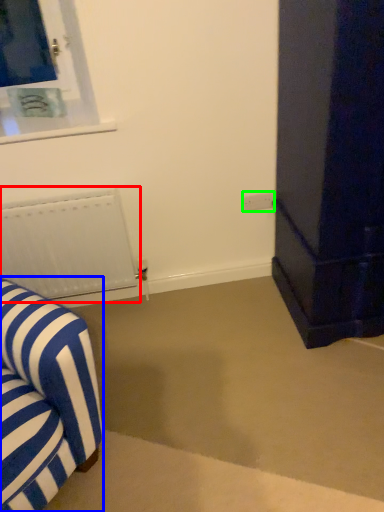
Question: Considering the real-world distances, which object is closest to radiator (highlighted by a red box)? furniture (highlighted by a blue box) or electric outlet (highlighted by a green box).

Choices:
 (A) furniture
 (B) electric outlet

Answer: (A)